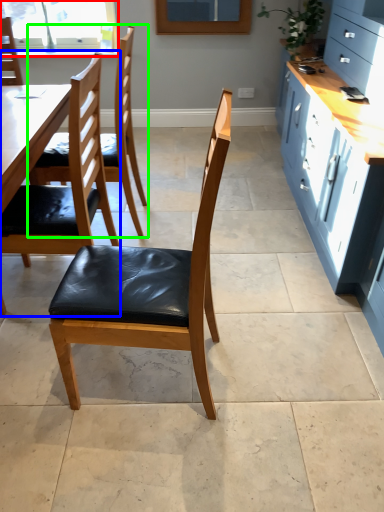
Question: Which is nearer to the window (highlighted by a red box)? chair (highlighted by a blue box) or chair (highlighted by a green box).

Choices:
 (A) chair
 (B) chair

Answer: (B)